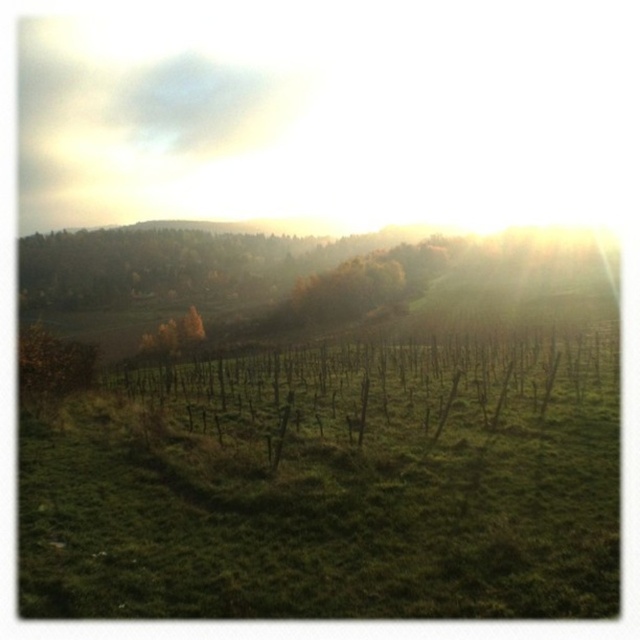
Question: Among these objects, which one is farthest from the camera?

Choices:
 (A) yellow-green leafy tree at center-left
 (B) green grassy field at center

Answer: (A)

Question: Does green leafy tree at left have a lesser width compared to yellow-green leafy tree at center-left?

Choices:
 (A) yes
 (B) no

Answer: (B)

Question: Does green leafy tree at left come behind yellow-green leafy tree at center-left?

Choices:
 (A) no
 (B) yes

Answer: (A)

Question: Where is green leafy tree at left located in relation to yellow-green leafy tree at center-left in the image?

Choices:
 (A) above
 (B) below

Answer: (A)

Question: Estimate the real-world distances between objects in this image. Which object is farther from the green grassy field at center?

Choices:
 (A) yellow-green leafy tree at center-left
 (B) green leafy tree at left

Answer: (A)

Question: Which object is positioned closest to the yellow-green leafy tree at center-left?

Choices:
 (A) green leafy tree at left
 (B) green grassy field at center

Answer: (A)